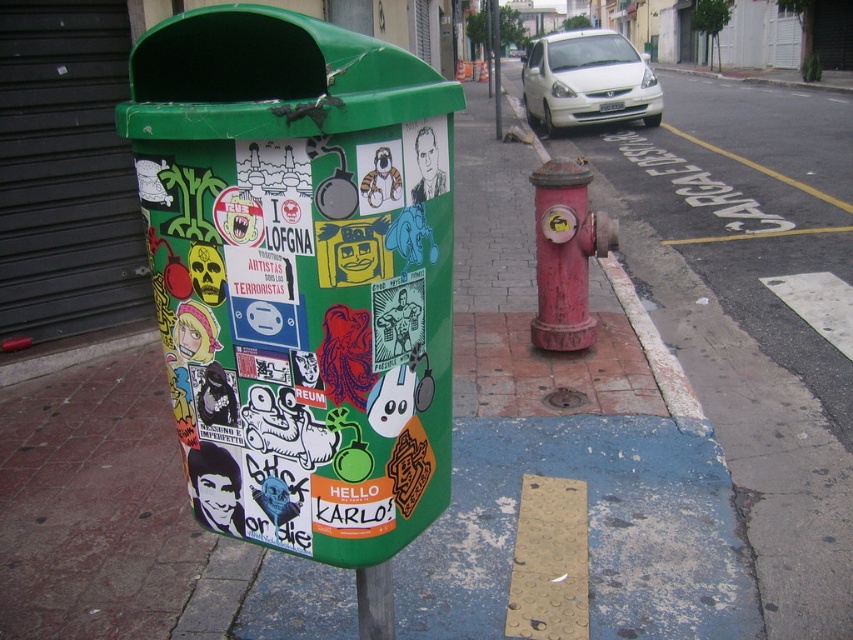
Who is lower down, smooth concrete sidewalk at center or red painted concrete curb at right?

Positioned lower is smooth concrete sidewalk at center.

Is point (827, 497) farther from camera compared to point (653, 324)?

No, (827, 497) is closer to viewer.

Locate an element on the screen. smooth concrete sidewalk at center is located at coordinates (759, 449).

Describe the element at coordinates (759, 449) in the screenshot. I see `smooth concrete sidewalk at center` at that location.

The height and width of the screenshot is (640, 853). What are the coordinates of `smooth concrete sidewalk at center` in the screenshot? It's located at (759, 449).

Between point (657, 285) and point (566, 298), which one is positioned behind?

Positioned behind is point (657, 285).

Image resolution: width=853 pixels, height=640 pixels. Identify the location of smooth concrete sidewalk at center. (759, 449).

Can you confirm if green matte trash can at left is positioned above rusty metal hydrant at center?

Incorrect, green matte trash can at left is not positioned above rusty metal hydrant at center.

Is green matte trash can at left positioned behind rusty metal hydrant at center?

No, green matte trash can at left is closer to the viewer.

What do you see at coordinates (299, 275) in the screenshot?
I see `green matte trash can at left` at bounding box center [299, 275].

Image resolution: width=853 pixels, height=640 pixels. Find the location of `green matte trash can at left`. green matte trash can at left is located at coordinates (299, 275).